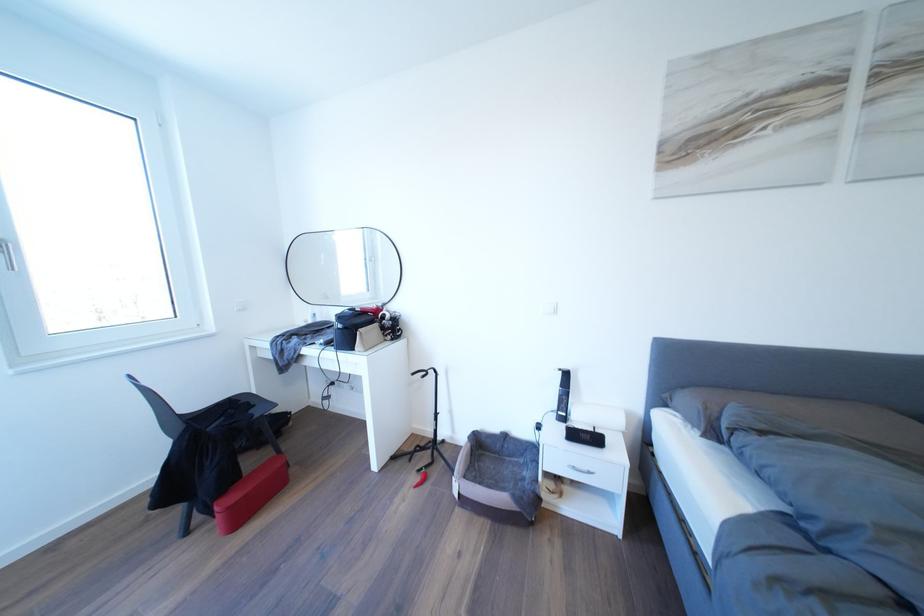
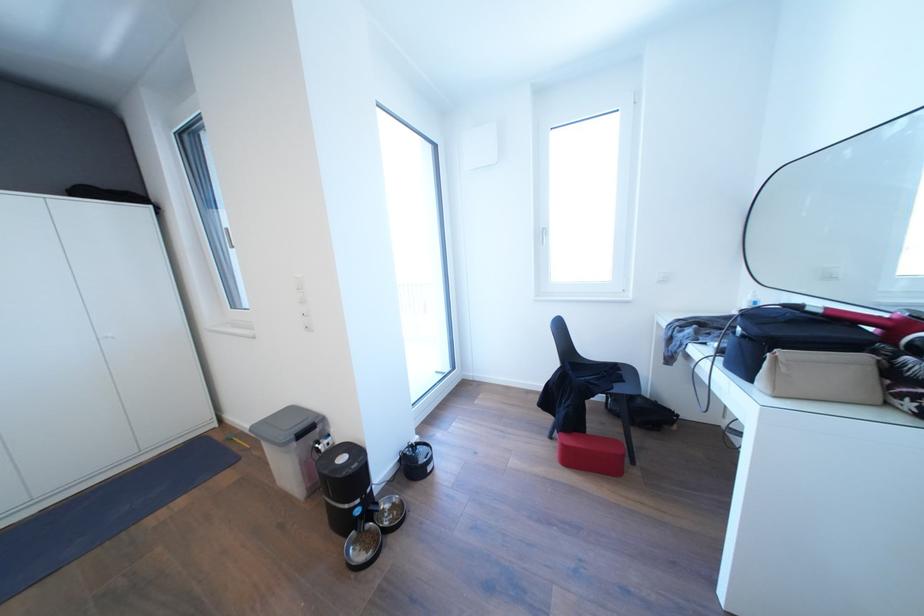
Question: The camera is either moving clockwise (left) or counter-clockwise (right) around the object. The first image is from the beginning of the video and the second image is from the end. Is the camera moving left or right when shooting the video?

Choices:
 (A) Left
 (B) Right

Answer: (B)